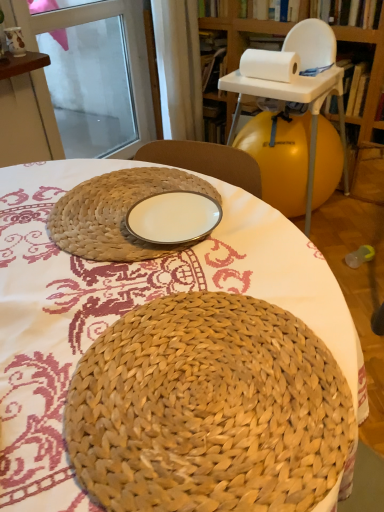
This screenshot has height=512, width=384. I want to click on vacant area on top of white glossy plate at center (from a real-world perspective), so click(167, 217).